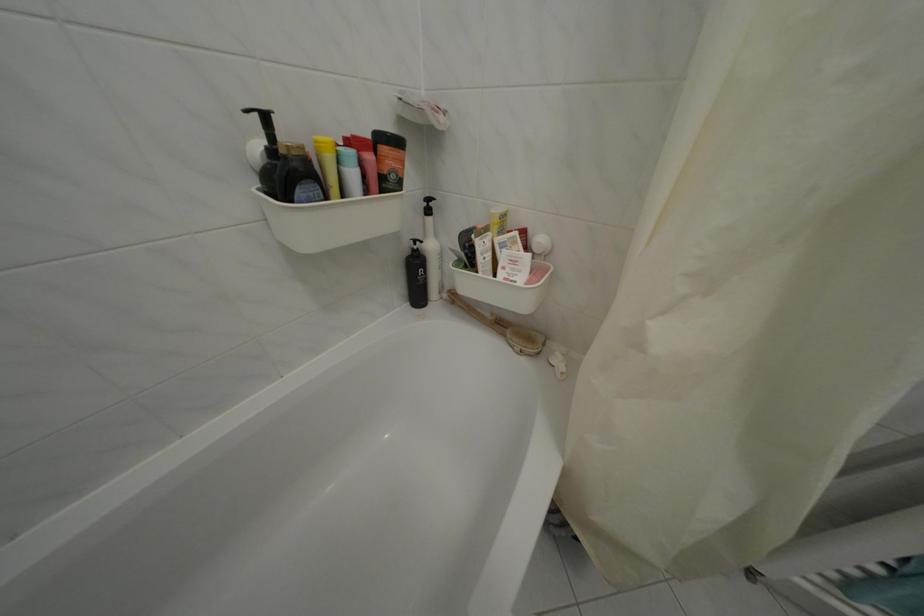
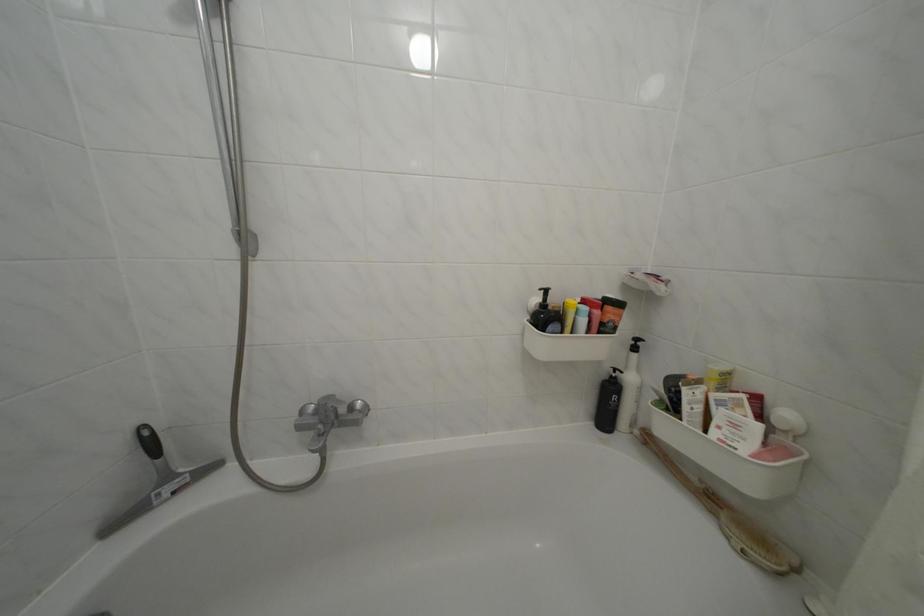
Where in the second image is the point corresponding to point 424,254 from the first image?

(623, 381)